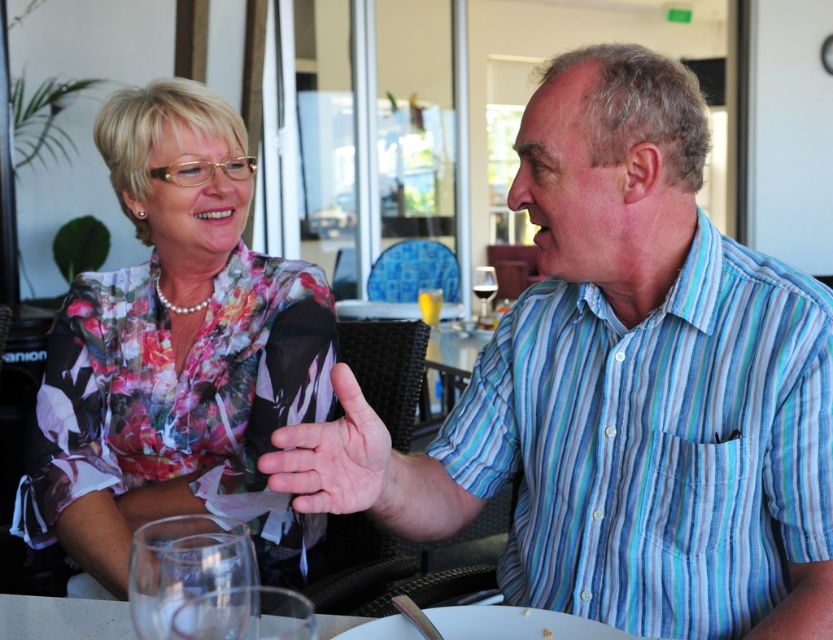
You are a waiter at a cafe and you see a customer who wants to place their drink on the table. There is a smooth skin hand at center and a transparent glass at upper center. Which object should the customer avoid placing the drink on to prevent it from falling off?

The customer should avoid placing the drink on the smooth skin hand at center because the transparent glass at upper center is positioned above it, so placing the drink on the hand might cause it to slide off onto the hand below.

You are a photographer standing in front of the scene. You want to take a photo of both the blue striped shirt at center and the floral fabric blouse at upper left. Which object is positioned closer to you?

The blue striped shirt at center is closer to the viewer than the floral fabric blouse at upper left.

You are a photographer taking a picture of the blue striped shirt at center and the transparent glass at lower left. To ensure both are in focus, where should you position the camera focus point?

The blue striped shirt at center is above the transparent glass at lower left, so you should focus on the transparent glass at lower left since it is closer to the camera.